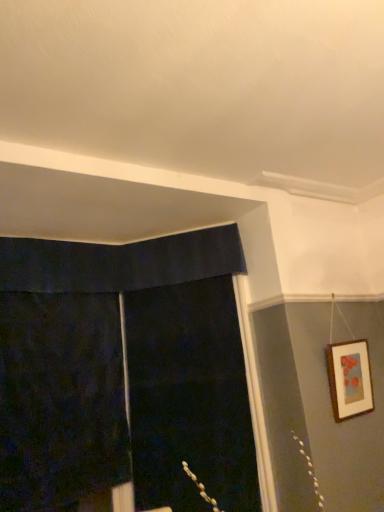
Question: Is point pyautogui.click(x=145, y=401) positioned closer to the camera than point pyautogui.click(x=334, y=371)?

Choices:
 (A) closer
 (B) farther

Answer: (B)

Question: Choose the correct answer: Is black fabric screen door at center inside wooden picture frame at upper right or outside it?

Choices:
 (A) inside
 (B) outside

Answer: (B)

Question: Which is farther from the wooden picture frame at upper right?

Choices:
 (A) black fabric screen door at center
 (B) dark velvet curtain at left

Answer: (B)

Question: Considering the real-world distances, which object is farthest from the dark velvet curtain at left?

Choices:
 (A) black fabric screen door at center
 (B) wooden picture frame at upper right

Answer: (B)